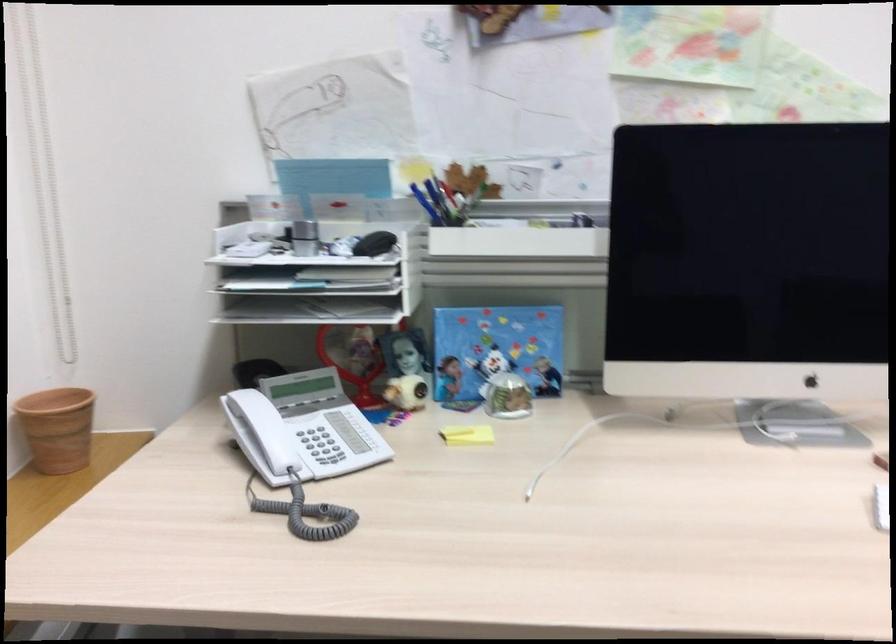
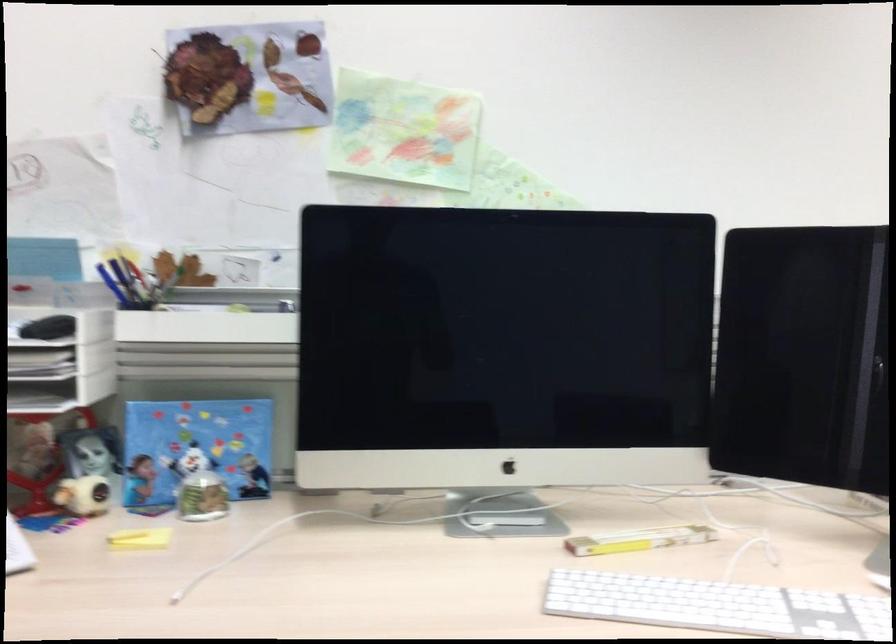
Question: In a continuous first-person perspective shot, in which direction is the camera moving?

Choices:
 (A) Left
 (B) Right
 (C) Forward
 (D) Backward

Answer: (B)